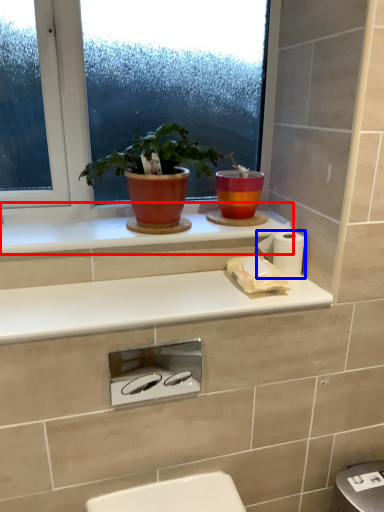
Question: Among these objects, which one is farthest to the camera, window sill (highlighted by a red box) or toilet paper (highlighted by a blue box)?

Choices:
 (A) window sill
 (B) toilet paper

Answer: (B)